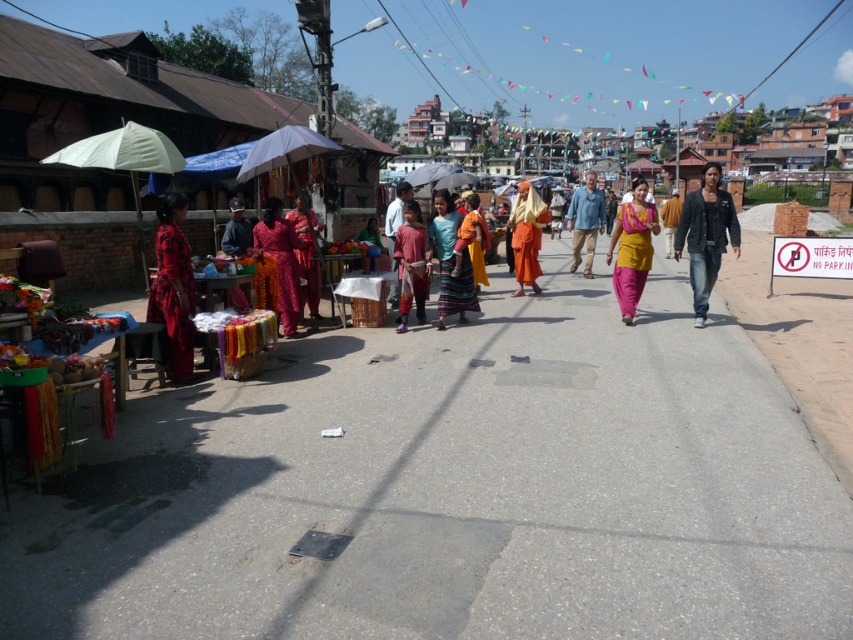
Can you confirm if dark blue denim jeans at right is thinner than white fabric umbrella at center?

In fact, dark blue denim jeans at right might be wider than white fabric umbrella at center.

Is dark blue denim jeans at right shorter than white fabric umbrella at center?

Yes, dark blue denim jeans at right is shorter than white fabric umbrella at center.

Image resolution: width=853 pixels, height=640 pixels. In order to click on dark blue denim jeans at right in this screenshot , I will do `click(706, 236)`.

This screenshot has height=640, width=853. What are the coordinates of `dark blue denim jeans at right` in the screenshot? It's located at (706, 236).

Which is behind, point (653, 208) or point (399, 257)?

The point (653, 208) is behind.

Is point (628, 232) positioned in front of point (405, 221)?

Yes, point (628, 232) is closer to viewer.

The width and height of the screenshot is (853, 640). I want to click on yellow cotton saree at center, so click(631, 248).

Which is behind, point (524, 260) or point (299, 125)?

Point (524, 260)

Between point (532, 280) and point (303, 152), which one is positioned behind?

Positioned behind is point (532, 280).

Find the location of a particular element. The image size is (853, 640). orange clothed monk at center is located at coordinates (526, 236).